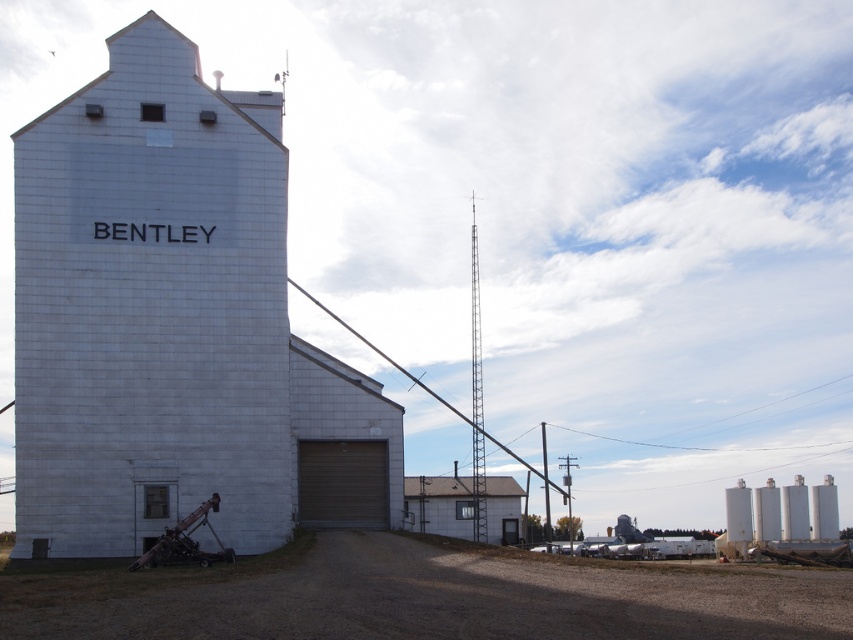
Question: Does white concrete grain silo at center appear on the right side of gray metal building at center?

Choices:
 (A) no
 (B) yes

Answer: (A)

Question: Does white concrete grain silo at center have a greater width compared to gray metal building at center?

Choices:
 (A) no
 (B) yes

Answer: (B)

Question: Which object is farther from the camera taking this photo?

Choices:
 (A) white concrete grain silo at center
 (B) gray metal building at center

Answer: (B)

Question: Is white concrete grain silo at center smaller than gray metal building at center?

Choices:
 (A) yes
 (B) no

Answer: (A)